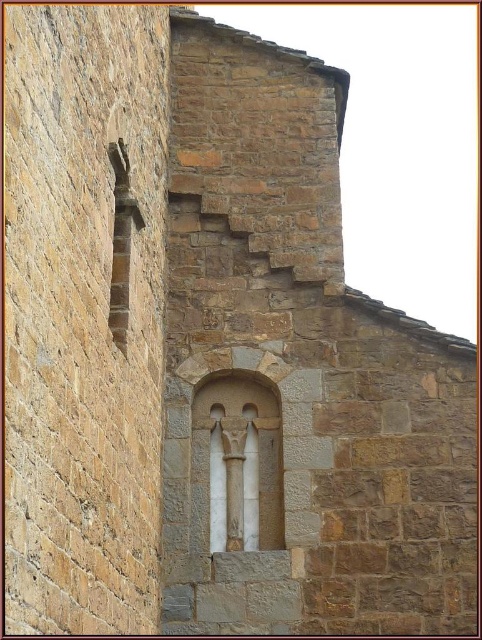
Question: Is white marble window at center positioned before white stone column at center?

Choices:
 (A) no
 (B) yes

Answer: (A)

Question: Which object is closer to the camera taking this photo?

Choices:
 (A) white marble window at center
 (B) white stone column at center

Answer: (B)

Question: Does white marble window at center have a larger size compared to white stone column at center?

Choices:
 (A) yes
 (B) no

Answer: (B)

Question: Is white marble window at center to the right of white stone column at center from the viewer's perspective?

Choices:
 (A) no
 (B) yes

Answer: (B)